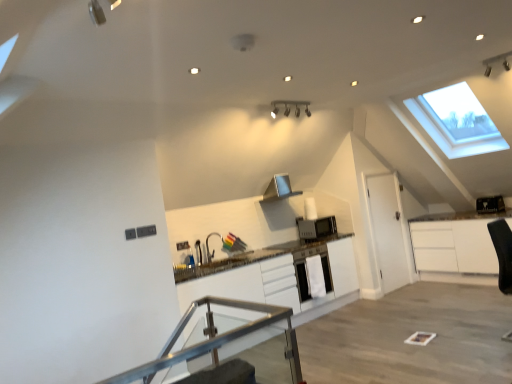
Identify the location of free space to the left of black leather swivel chair at lower right. (472, 333).